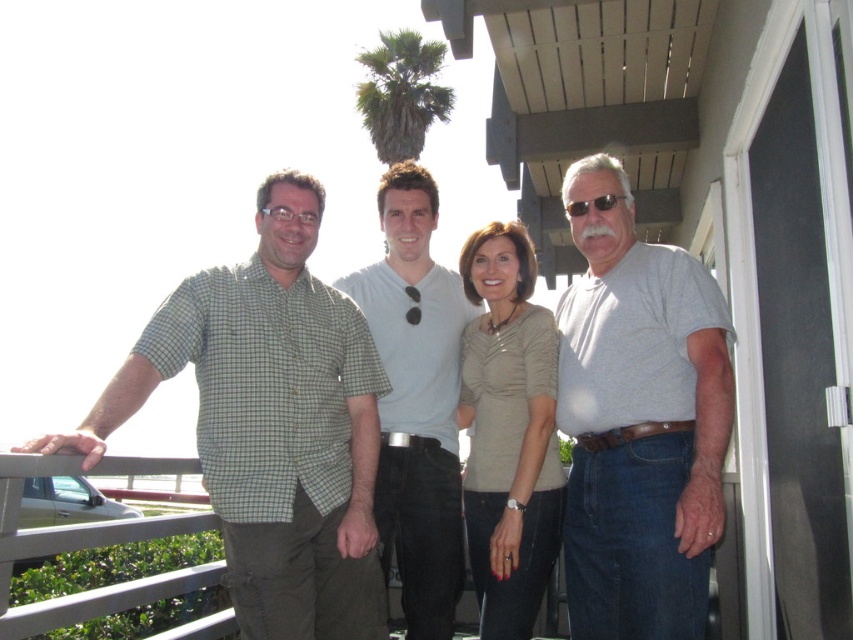
Question: Which point appears farthest from the camera in this image?

Choices:
 (A) (292, 554)
 (B) (433, 472)

Answer: (B)

Question: Can you confirm if gray matte t-shirt at right is thinner than white cotton t-shirt at center?

Choices:
 (A) yes
 (B) no

Answer: (A)

Question: Which object appears farthest from the camera in this image?

Choices:
 (A) matte beige blouse at center
 (B) green checkered shirt at left
 (C) white cotton t-shirt at center

Answer: (C)

Question: Is gray matte t-shirt at right wider than matte beige blouse at center?

Choices:
 (A) yes
 (B) no

Answer: (A)

Question: Is green checkered shirt at left closer to camera compared to gray matte t-shirt at right?

Choices:
 (A) no
 (B) yes

Answer: (B)

Question: Considering the real-world distances, which object is farthest from the green checkered shirt at left?

Choices:
 (A) matte beige blouse at center
 (B) white cotton t-shirt at center

Answer: (A)